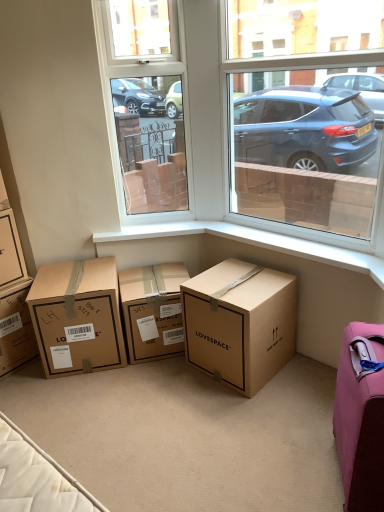
Question: From the image's perspective, would you say brown cardboard box at lower left, the 1th box positioned from the left, is shown under pink fabric suitcase at lower right?

Choices:
 (A) yes
 (B) no

Answer: (B)

Question: Considering the relative positions of brown cardboard box at lower left, the 1th box positioned from the left, and pink fabric suitcase at lower right in the image provided, is brown cardboard box at lower left, the 1th box positioned from the left, to the left of pink fabric suitcase at lower right from the viewer's perspective?

Choices:
 (A) no
 (B) yes

Answer: (B)

Question: Is brown cardboard box at lower left, which is counted as the 5th box, starting from the right, not within pink fabric suitcase at lower right?

Choices:
 (A) yes
 (B) no

Answer: (A)

Question: Is the position of brown cardboard box at lower left, which is counted as the 5th box, starting from the right, less distant than that of pink fabric suitcase at lower right?

Choices:
 (A) yes
 (B) no

Answer: (B)

Question: Considering the relative sizes of brown cardboard box at lower left, which is counted as the 5th box, starting from the right, and pink fabric suitcase at lower right in the image provided, is brown cardboard box at lower left, which is counted as the 5th box, starting from the right, thinner than pink fabric suitcase at lower right?

Choices:
 (A) no
 (B) yes

Answer: (A)

Question: In terms of width, does brown cardboard box at left, arranged as the 4th box when viewed from the right, look wider or thinner when compared to brown cardboard box at lower center, which is the 5th box in left-to-right order?

Choices:
 (A) wide
 (B) thin

Answer: (B)

Question: Is point (6, 245) positioned closer to the camera than point (273, 315)?

Choices:
 (A) farther
 (B) closer

Answer: (A)

Question: From a real-world perspective, is brown cardboard box at left, which ranks as the second box in left-to-right order, positioned above or below brown cardboard box at lower center, which is the 5th box in left-to-right order?

Choices:
 (A) above
 (B) below

Answer: (A)

Question: Visually, is brown cardboard box at left, which ranks as the second box in left-to-right order, positioned to the left or to the right of brown cardboard box at lower center, which is the 5th box in left-to-right order?

Choices:
 (A) left
 (B) right

Answer: (A)

Question: From a real-world perspective, is brown cardboard box at center, the second box from the right, physically located above or below brown cardboard box at lower left, which is counted as the 5th box, starting from the right?

Choices:
 (A) below
 (B) above

Answer: (A)

Question: In terms of height, does brown cardboard box at center, the second box from the right, look taller or shorter compared to brown cardboard box at lower left, which is counted as the 5th box, starting from the right?

Choices:
 (A) short
 (B) tall

Answer: (A)

Question: Which is correct: brown cardboard box at center, arranged as the 4th box when viewed from the left, is inside brown cardboard box at lower left, which is counted as the 5th box, starting from the right, or outside of it?

Choices:
 (A) inside
 (B) outside

Answer: (B)

Question: From the image's perspective, is brown cardboard box at center, the second box from the right, above or below brown cardboard box at lower left, the 1th box positioned from the left?

Choices:
 (A) above
 (B) below

Answer: (A)

Question: In the image, is brown cardboard box at lower left, the 1th box positioned from the left, positioned in front of or behind brown cardboard box at left, which ranks as the second box in left-to-right order?

Choices:
 (A) behind
 (B) front

Answer: (A)

Question: Considering the positions of brown cardboard box at lower left, which is counted as the 5th box, starting from the right, and brown cardboard box at left, which ranks as the second box in left-to-right order, in the image, is brown cardboard box at lower left, which is counted as the 5th box, starting from the right, taller or shorter than brown cardboard box at left, which ranks as the second box in left-to-right order,?

Choices:
 (A) tall
 (B) short

Answer: (A)